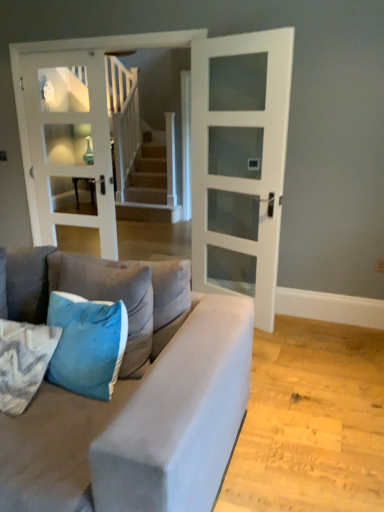
Question: Can you see teal velvet pillow at lower left, marked as the 2th pillow in a left-to-right arrangement, touching white glass door at center, the 2th door when ordered from left to right?

Choices:
 (A) yes
 (B) no

Answer: (B)

Question: Can you confirm if teal velvet pillow at lower left, marked as the 2th pillow in a left-to-right arrangement, is smaller than white glass door at center, the 2th door when ordered from left to right?

Choices:
 (A) yes
 (B) no

Answer: (A)

Question: Is teal velvet pillow at lower left, marked as the 2th pillow in a right-to-left arrangement, positioned beyond the bounds of white glass door at center, the 2th door when ordered from left to right?

Choices:
 (A) yes
 (B) no

Answer: (A)

Question: Is teal velvet pillow at lower left, marked as the 2th pillow in a right-to-left arrangement, aimed at white glass door at center, which is counted as the 1th door, starting from the right?

Choices:
 (A) no
 (B) yes

Answer: (B)

Question: Is teal velvet pillow at lower left, marked as the 2th pillow in a left-to-right arrangement, at the right side of white glass door at center, the 2th door when ordered from left to right?

Choices:
 (A) no
 (B) yes

Answer: (A)

Question: Considering the relative sizes of teal velvet pillow at lower left, marked as the 2th pillow in a left-to-right arrangement, and white glass door at center, which is counted as the 1th door, starting from the right, in the image provided, is teal velvet pillow at lower left, marked as the 2th pillow in a left-to-right arrangement, thinner than white glass door at center, which is counted as the 1th door, starting from the right,?

Choices:
 (A) no
 (B) yes

Answer: (A)

Question: Is blue fabric pillow at lower left, which is the 1th pillow in left-to-right order, oriented away from velvet blue pillow at lower left, the first pillow when ordered from right to left?

Choices:
 (A) no
 (B) yes

Answer: (A)

Question: Is the surface of blue fabric pillow at lower left, which is the 3th pillow from right to left, in direct contact with velvet blue pillow at lower left, the first pillow when ordered from right to left?

Choices:
 (A) no
 (B) yes

Answer: (A)

Question: From the image's perspective, is blue fabric pillow at lower left, which is the 3th pillow from right to left, located above velvet blue pillow at lower left, the first pillow when ordered from right to left?

Choices:
 (A) no
 (B) yes

Answer: (A)

Question: From a real-world perspective, is blue fabric pillow at lower left, which is the 1th pillow in left-to-right order, beneath velvet blue pillow at lower left, the first pillow when ordered from right to left?

Choices:
 (A) yes
 (B) no

Answer: (A)

Question: Considering the relative sizes of blue fabric pillow at lower left, which is the 3th pillow from right to left, and velvet blue pillow at lower left, the third pillow in the left-to-right sequence, in the image provided, is blue fabric pillow at lower left, which is the 3th pillow from right to left, wider than velvet blue pillow at lower left, the third pillow in the left-to-right sequence,?

Choices:
 (A) no
 (B) yes

Answer: (B)

Question: Is blue fabric pillow at lower left, which is the 3th pillow from right to left, positioned far away from velvet blue pillow at lower left, the third pillow in the left-to-right sequence?

Choices:
 (A) yes
 (B) no

Answer: (B)

Question: Considering the relative positions of white glass door at center, which is counted as the first door, starting from the left, and blue fabric pillow at lower left, which is the 1th pillow in left-to-right order, in the image provided, is white glass door at center, which is counted as the first door, starting from the left, in front of blue fabric pillow at lower left, which is the 1th pillow in left-to-right order,?

Choices:
 (A) yes
 (B) no

Answer: (B)